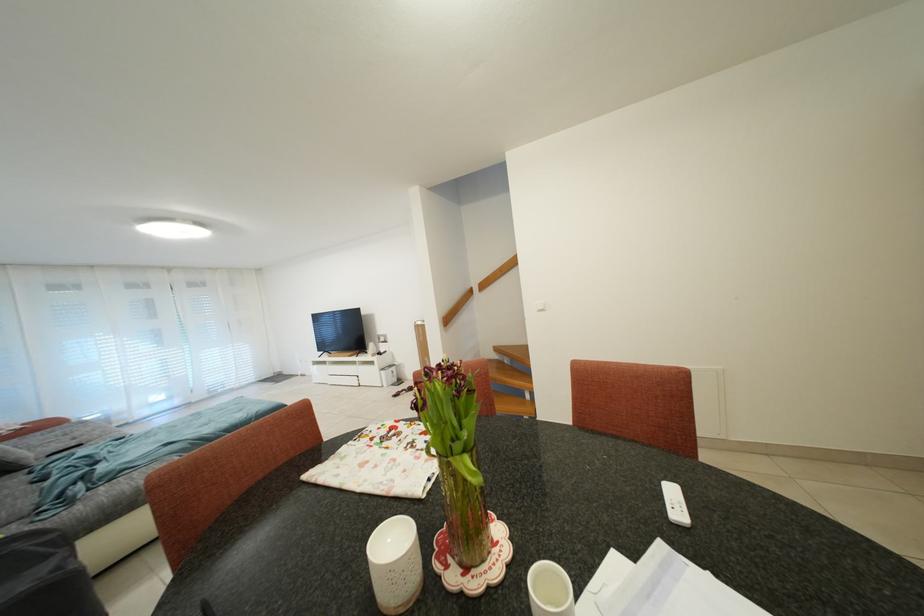
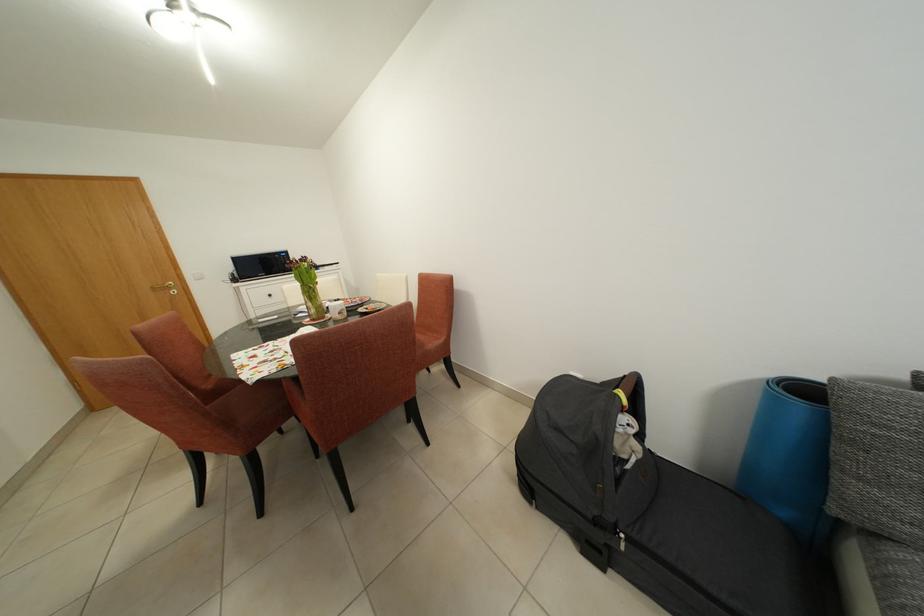
Where in the second image is the point corresponding to [399,549] from the first image?

(345, 307)